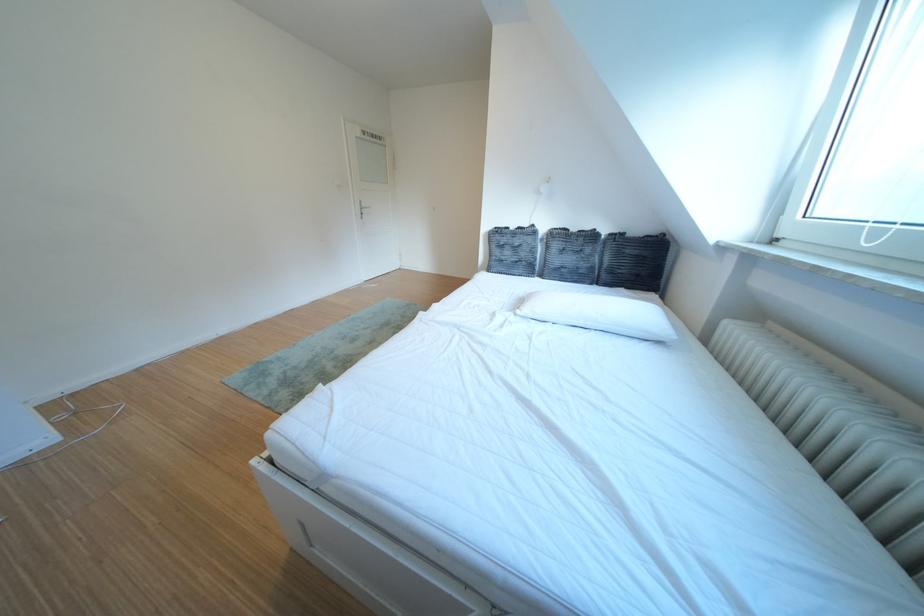
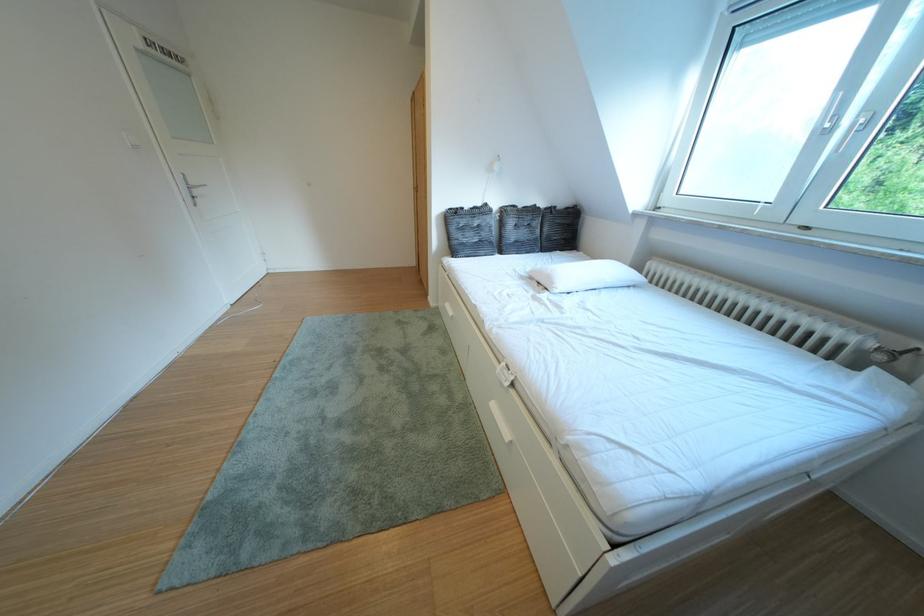
In the second image, find the point that corresponds to (507,264) in the first image.

(468, 246)